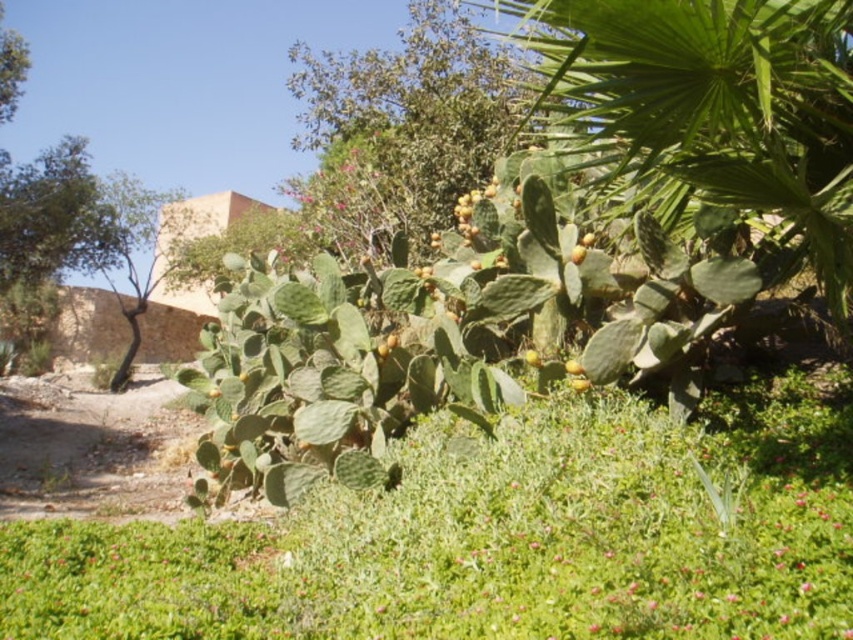
You are a gardener standing in front of the prickly pear cactus. You notice the green leafy grass at center and the yellow matte fruit at center. Which object is nearer to you?

The green leafy grass at center is closer to the viewer than the yellow matte fruit at center.

You are a gardener who wants to plant a new shrub between the green leafy grass at center and the green leafy palm at upper right. The shrub requires a space of 2 meters between them to grow properly. Can you plant it there?

The distance between the green leafy grass at center and the green leafy palm at upper right is 2.17 meters, which is more than the required 2 meters. Therefore, you can plant the shrub there.